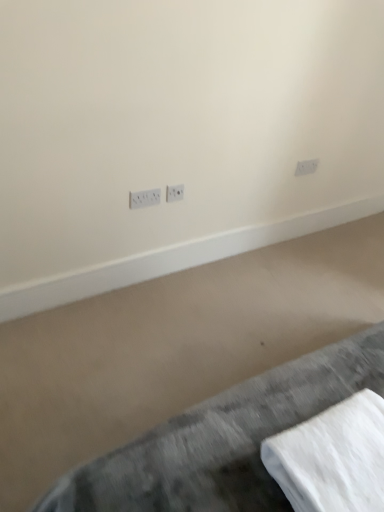
Question: Is white plastic power plugs and sockets at center, placed as the 1th power plugs and sockets when sorted from left to right, bigger or smaller than white plastic power plugs and sockets at upper right, the 3th power plugs and sockets from the left?

Choices:
 (A) small
 (B) big

Answer: (B)

Question: Considering the relative positions of white plastic power plugs and sockets at center, marked as the 1th power plugs and sockets in a front-to-back arrangement, and white plastic power plugs and sockets at upper right, positioned as the first power plugs and sockets in top-to-bottom order, in the image provided, is white plastic power plugs and sockets at center, marked as the 1th power plugs and sockets in a front-to-back arrangement, to the left or to the right of white plastic power plugs and sockets at upper right, positioned as the first power plugs and sockets in top-to-bottom order,?

Choices:
 (A) right
 (B) left

Answer: (B)

Question: Estimate the real-world distances between objects in this image. Which object is closer to the white cotton towel at lower right?

Choices:
 (A) white plastic power plugs and sockets at center, placed as the 1th power plugs and sockets when sorted from left to right
 (B) white plastic power plugs and sockets at center, which ranks as the 2th power plugs and sockets in left-to-right order
 (C) gray fabric bed at lower right
 (D) white plastic power plugs and sockets at upper right, placed as the third power plugs and sockets when sorted from front to back

Answer: (C)

Question: Estimate the real-world distances between objects in this image. Which object is farther from the white plastic power plugs and sockets at center, placed as the 1th power plugs and sockets when sorted from left to right?

Choices:
 (A) white cotton towel at lower right
 (B) white plastic power plugs and sockets at center, placed as the second power plugs and sockets when sorted from bottom to top
 (C) white plastic power plugs and sockets at upper right, the 3th power plugs and sockets from the left
 (D) gray fabric bed at lower right

Answer: (A)